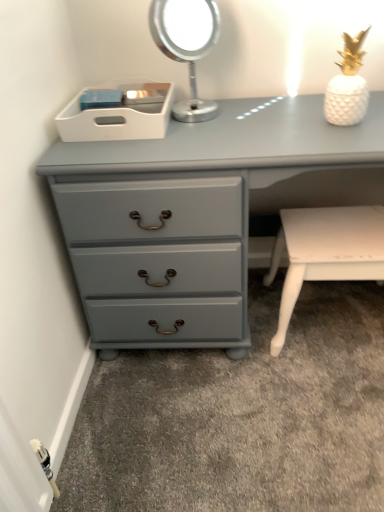
Image resolution: width=384 pixels, height=512 pixels. I want to click on vacant space in front of white glossy table at lower right, so click(321, 409).